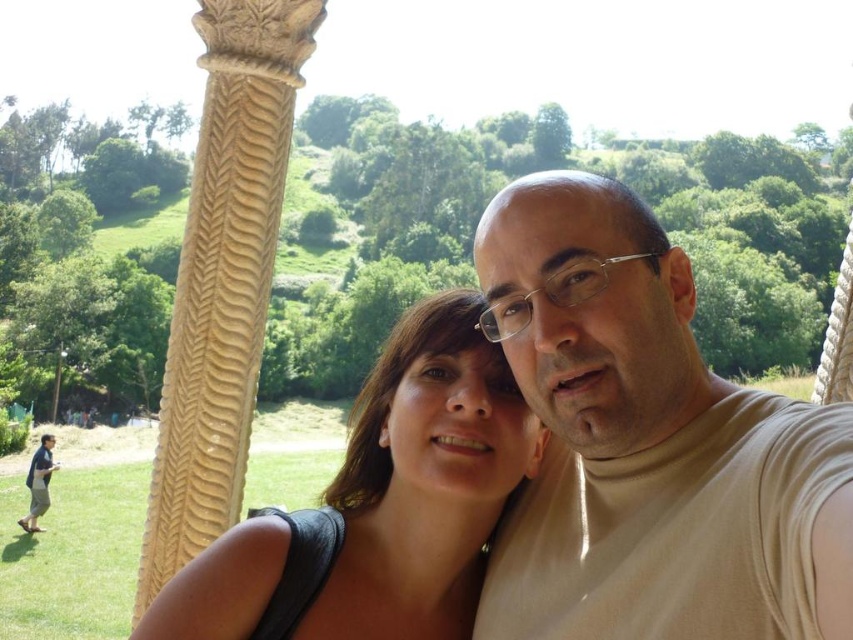
Can you confirm if beige turtleneck at center is thinner than blue denim jeans at lower left?

Yes.

Who is higher up, beige turtleneck at center or blue denim jeans at lower left?

beige turtleneck at center is higher up.

Is point (625, 410) closer to viewer compared to point (54, 442)?

Yes, it is.

Find the location of `beige turtleneck at center`. beige turtleneck at center is located at coordinates point(648,444).

Consider the image. Does matte black hair at center appear under blue denim jeans at lower left?

No, matte black hair at center is not below blue denim jeans at lower left.

Can you confirm if matte black hair at center is thinner than blue denim jeans at lower left?

In fact, matte black hair at center might be wider than blue denim jeans at lower left.

Where is `matte black hair at center`? This screenshot has height=640, width=853. matte black hair at center is located at coordinates (380, 504).

Locate an element on the screen. The height and width of the screenshot is (640, 853). beige turtleneck at center is located at coordinates (648, 444).

Does beige turtleneck at center have a smaller size compared to matte black hair at center?

Yes.

In order to click on beige turtleneck at center in this screenshot , I will do `click(648, 444)`.

Identify the location of beige turtleneck at center. The width and height of the screenshot is (853, 640). (648, 444).